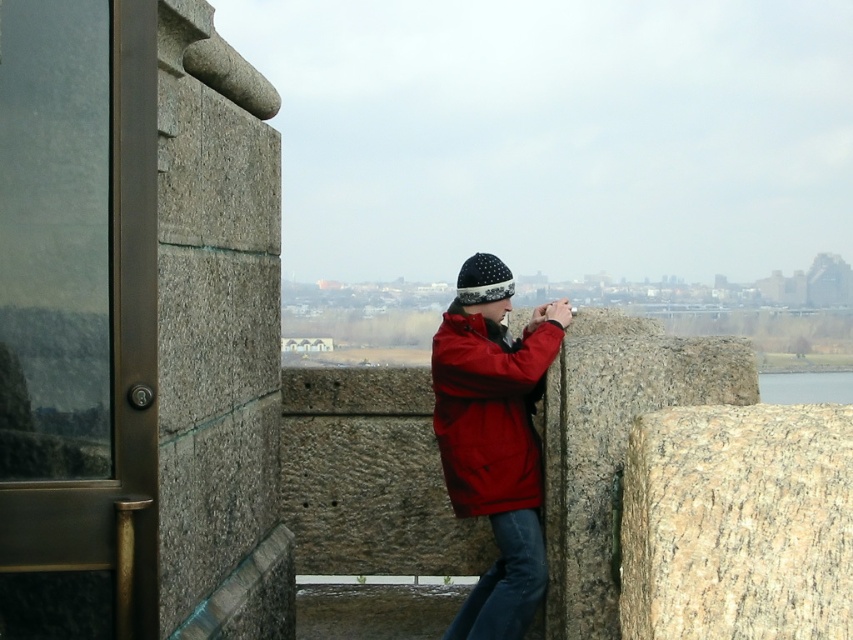
Is matte red jacket at center wider than denim at center?

Correct, the width of matte red jacket at center exceeds that of denim at center.

Is point (518, 448) farther from viewer compared to point (492, 621)?

Yes, point (518, 448) is behind point (492, 621).

Where is `matte red jacket at center`? matte red jacket at center is located at coordinates (489, 410).

Where is `matte red jacket at center`? matte red jacket at center is located at coordinates (489, 410).